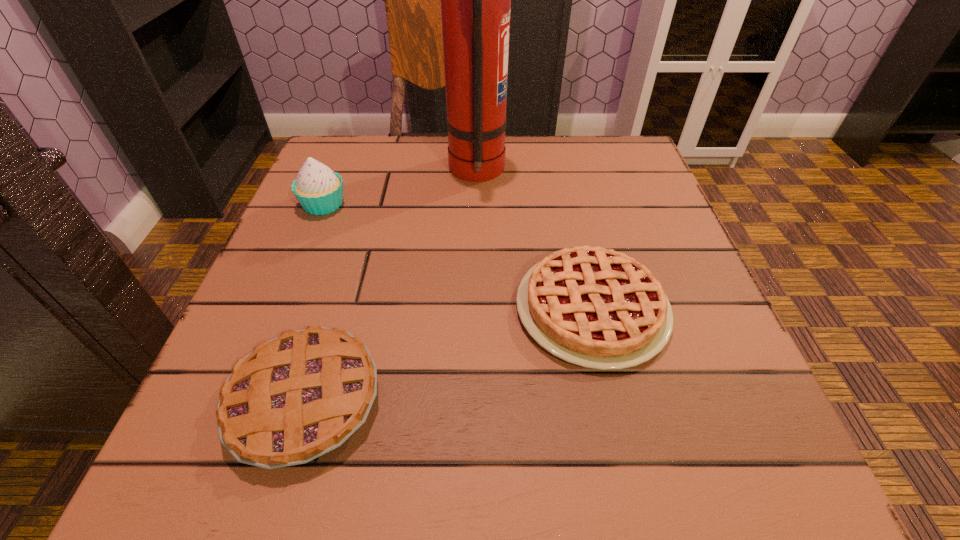
I want to click on vacant region at the right edge, so click(x=677, y=266).

In the image, there is a desktop. Find the location of `vacant space at the far left corner`. vacant space at the far left corner is located at coordinates (364, 150).

I want to click on vacant space at the far right corner, so click(x=628, y=136).

Locate an element on the screen. Image resolution: width=960 pixels, height=540 pixels. vacant space at the near right corner of the desktop is located at coordinates (679, 441).

You are a GUI agent. You are given a task and a screenshot of the screen. Output one action in this format:
    pyautogui.click(x=<x>, y=<y>)
    Task: Click on the free space between the tallest object and the left pie
    
    Given the screenshot: What is the action you would take?
    pyautogui.click(x=391, y=286)

Where is `vacant area that lies between the left pie and the cupcake`? The width and height of the screenshot is (960, 540). vacant area that lies between the left pie and the cupcake is located at coordinates (315, 302).

I want to click on free space that is in between the cupcake and the left pie, so click(x=315, y=302).

The image size is (960, 540). I want to click on vacant region between the left pie and the right pie, so click(x=448, y=354).

Find the location of a particular element. unoccupied position between the left pie and the right pie is located at coordinates (448, 354).

In order to click on vacant space in between the rightmost object and the tallest object in this screenshot , I will do `click(535, 240)`.